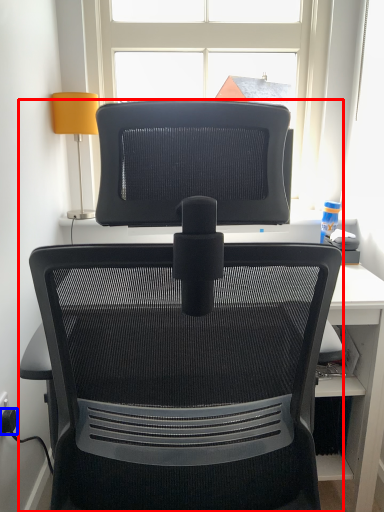
Question: Which point is closer to the camera, chair (highlighted by a red box) or plug (highlighted by a blue box)?

Choices:
 (A) chair
 (B) plug

Answer: (A)